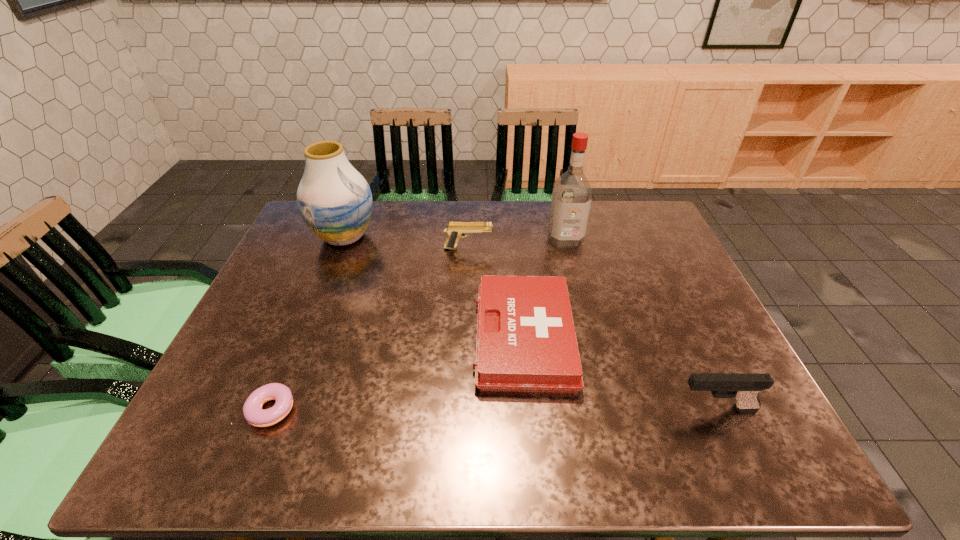
Where is `free location located 0.380m on the front-facing side of the right pistol`? free location located 0.380m on the front-facing side of the right pistol is located at coordinates (492, 408).

I want to click on free space located 0.400m on the front-facing side of the right pistol, so click(x=482, y=408).

Locate an element on the screen. The height and width of the screenshot is (540, 960). free location located 0.380m on the front-facing side of the right pistol is located at coordinates (492, 408).

Identify the location of free spot located 0.260m at the barrel of the shorter pistol. (579, 248).

Where is `vacant space located 0.330m on the left of the first-aid kit`? Image resolution: width=960 pixels, height=540 pixels. vacant space located 0.330m on the left of the first-aid kit is located at coordinates (336, 338).

Where is `free space located on the back of the doughnut`? The image size is (960, 540). free space located on the back of the doughnut is located at coordinates (317, 292).

The image size is (960, 540). I want to click on liquor situated at the far edge, so click(x=572, y=193).

What are the coordinates of `vase present at the far edge` in the screenshot? It's located at (335, 201).

This screenshot has height=540, width=960. In order to click on object located at the near edge in this screenshot , I will do `click(254, 414)`.

The image size is (960, 540). Find the location of `vase located at the left edge`. vase located at the left edge is located at coordinates (335, 201).